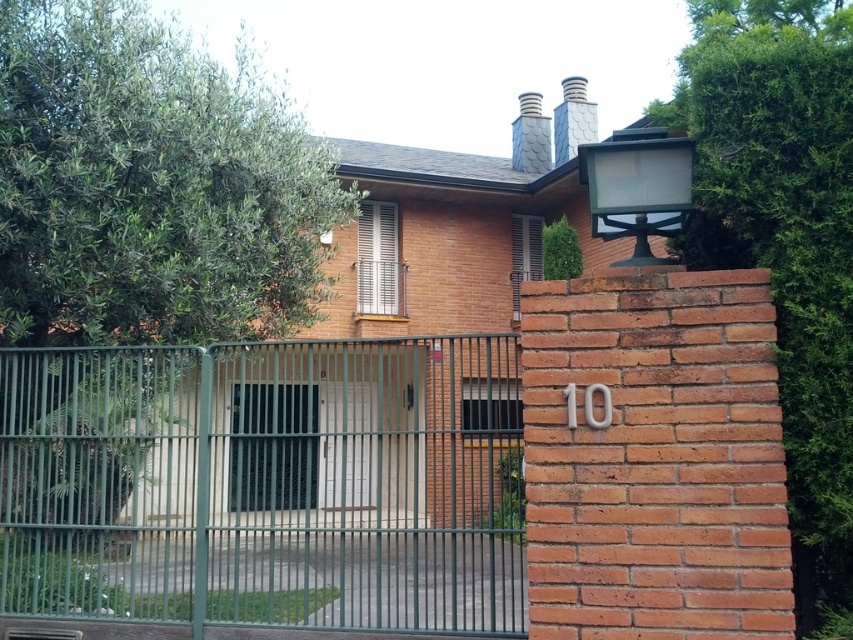
You are standing in front of the residential building and want to plant a new tree that needs at least 12 feet of space between it and the green leafy tree at left. Is the current distance sufficient?

The green leafy tree at left and viewer are 10.82 feet apart from each other. Since the required distance is 12 feet, the current distance of 10.82 feet is insufficient. You need to plant the new tree farther away from the green leafy tree at left to meet the requirement.

You are a delivery person arriving at this building to drop off a package. You need to enter through the white glossy door at center. However, there is a green leafy tree at right nearby. Can you easily access the door without having to move the tree?

The green leafy tree at right is larger in size than the white glossy door at center, but since the tree is at the right and the door is at the center, they are positioned apart. Therefore, you can easily access the white glossy door at center without needing to move the tree.

You are standing in front of the residential building and want to walk towards the green leafy tree at left and the green leafy tree at right. Which tree will you reach first?

The green leafy tree at left is closer to you than the green leafy tree at right, so you will reach the green leafy tree at left first.